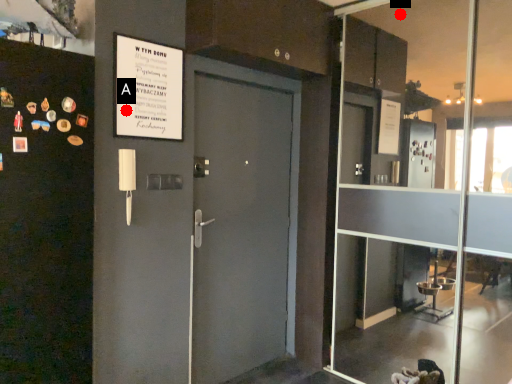
Question: Two points are circled on the image, labeled by A and B beside each circle. Which point appears farthest from the camera in this image?

Choices:
 (A) A is further
 (B) B is further

Answer: (B)